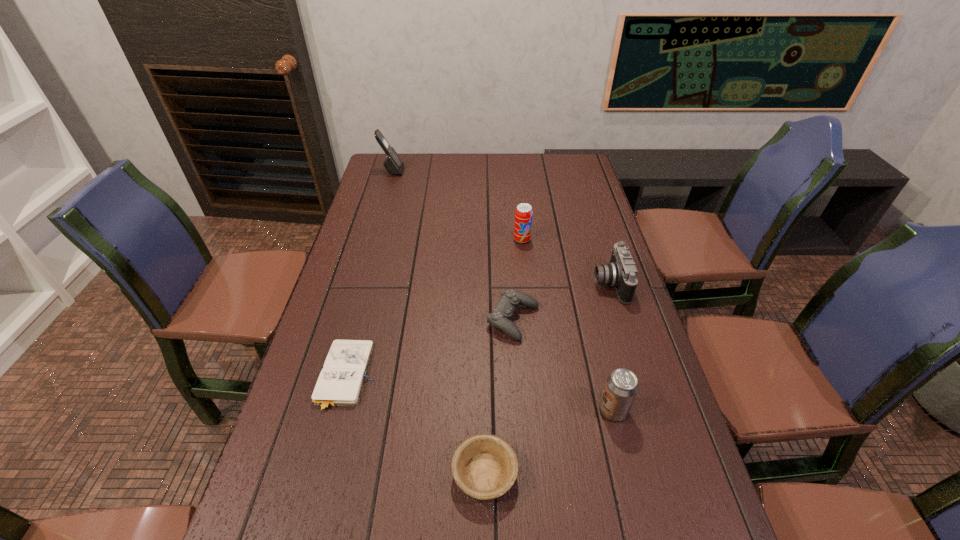
This screenshot has height=540, width=960. I want to click on free space between the control and the sixth nearest object, so click(x=517, y=280).

Locate an element on the screen. free space between the second farthest object and the second shortest object is located at coordinates (503, 357).

Identify the location of unoccupied area between the control and the camera. The height and width of the screenshot is (540, 960). click(x=562, y=302).

I want to click on the fifth closest object relative to the fifth tallest object, so (340, 382).

Select which object appears as the sixth closest to the tallest object. Please provide its 2D coordinates. Your answer should be formatted as a tuple, i.e. [(x, y)], where the tuple contains the x and y coordinates of a point satisfying the conditions above.

[(621, 387)]

Where is `vacant position in the image that satisfies the following two spatial constraints: 1. on the back side of the shortest object; 2. on the front-facing side of the cellular telephone`? Image resolution: width=960 pixels, height=540 pixels. vacant position in the image that satisfies the following two spatial constraints: 1. on the back side of the shortest object; 2. on the front-facing side of the cellular telephone is located at coordinates (399, 171).

Find the location of a particular element. vacant space that satisfies the following two spatial constraints: 1. on the back side of the control; 2. on the right side of the nearest object is located at coordinates (484, 320).

Find the location of `vacant space that satisfies the following two spatial constraints: 1. on the front-facing side of the rightmost object; 2. on the front side of the beer can`. vacant space that satisfies the following two spatial constraints: 1. on the front-facing side of the rightmost object; 2. on the front side of the beer can is located at coordinates (649, 410).